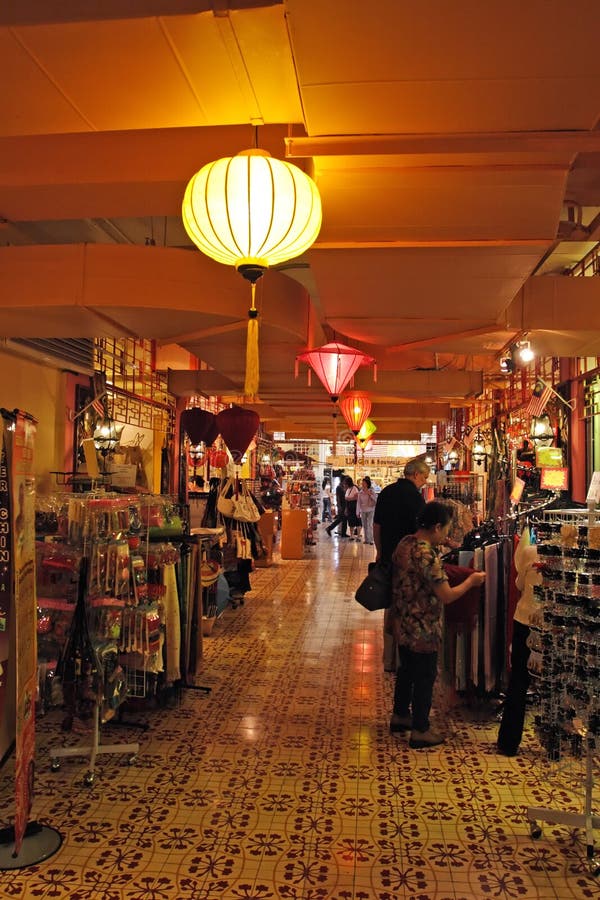
Where is `red decorative floor tile`? The image size is (600, 900). red decorative floor tile is located at coordinates pos(229,820), pos(311,824), pos(398,830), pos(488,834).